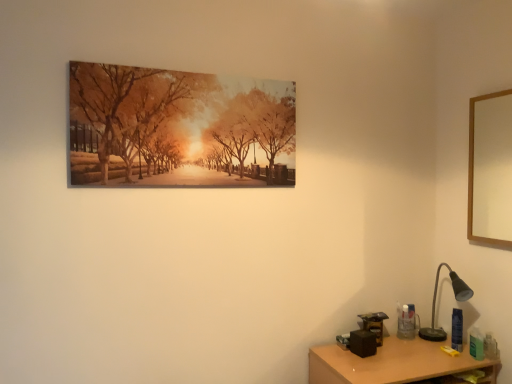
What do you see at coordinates (435, 304) in the screenshot? I see `black metal table lamp at lower right` at bounding box center [435, 304].

Describe the element at coordinates (490, 169) in the screenshot. This screenshot has width=512, height=384. I see `wooden picture frame at upper right, the second picture frame from the left` at that location.

What do you see at coordinates (393, 363) in the screenshot?
I see `wooden desk at lower right` at bounding box center [393, 363].

What do you see at coordinates (178, 129) in the screenshot? I see `matte canvas print at upper center, placed as the first picture frame when sorted from left to right` at bounding box center [178, 129].

Identify the location of black metal table lamp at lower right. (435, 304).

Does wooden picture frame at upper right, the second picture frame from the left, have a greater width compared to wooden desk at lower right?

No, wooden picture frame at upper right, the second picture frame from the left, is not wider than wooden desk at lower right.

Does wooden picture frame at upper right, the first picture frame viewed from the right, have a larger size compared to wooden desk at lower right?

A: No, wooden picture frame at upper right, the first picture frame viewed from the right, is not bigger than wooden desk at lower right.

From a real-world perspective, who is located lower, wooden picture frame at upper right, the second picture frame from the left, or wooden desk at lower right?

From a 3D spatial view, wooden desk at lower right is below.

Which of these two, matte canvas print at upper center, placed as the first picture frame when sorted from left to right, or black metal table lamp at lower right, is thinner?

With smaller width is matte canvas print at upper center, placed as the first picture frame when sorted from left to right.

Can you tell me how much matte canvas print at upper center, the second picture frame viewed from the right, and black metal table lamp at lower right differ in facing direction?

They differ by 11.4 degrees in their facing directions.

From a real-world perspective, which picture frame is the 2nd one above the black metal table lamp at lower right? Please provide its 2D coordinates.

[(178, 129)]

Considering the sizes of objects matte canvas print at upper center, the second picture frame viewed from the right, and black metal table lamp at lower right in the image provided, who is taller, matte canvas print at upper center, the second picture frame viewed from the right, or black metal table lamp at lower right?

With more height is matte canvas print at upper center, the second picture frame viewed from the right.

Can you confirm if matte canvas print at upper center, the second picture frame viewed from the right, is taller than wooden picture frame at upper right, the first picture frame viewed from the right?

No, matte canvas print at upper center, the second picture frame viewed from the right, is not taller than wooden picture frame at upper right, the first picture frame viewed from the right.

From the image's perspective, is matte canvas print at upper center, placed as the first picture frame when sorted from left to right, above or below wooden picture frame at upper right, the second picture frame from the left?

Based on their image positions, matte canvas print at upper center, placed as the first picture frame when sorted from left to right, is located above wooden picture frame at upper right, the second picture frame from the left.

Is matte canvas print at upper center, placed as the first picture frame when sorted from left to right, touching wooden picture frame at upper right, the second picture frame from the left?

There is a gap between matte canvas print at upper center, placed as the first picture frame when sorted from left to right, and wooden picture frame at upper right, the second picture frame from the left.

How many degrees apart are the facing directions of matte canvas print at upper center, the second picture frame viewed from the right, and wooden picture frame at upper right, the first picture frame viewed from the right?

matte canvas print at upper center, the second picture frame viewed from the right, and wooden picture frame at upper right, the first picture frame viewed from the right, are facing 90.5 degrees away from each other.

Which is more to the right, wooden desk at lower right or wooden picture frame at upper right, the second picture frame from the left?

From the viewer's perspective, wooden picture frame at upper right, the second picture frame from the left, appears more on the right side.

Is wooden desk at lower right wider than wooden picture frame at upper right, the second picture frame from the left?

Yes.

Considering the sizes of objects wooden desk at lower right and wooden picture frame at upper right, the second picture frame from the left, in the image provided, who is bigger, wooden desk at lower right or wooden picture frame at upper right, the second picture frame from the left,?

wooden desk at lower right is bigger.

From the picture: Is wooden desk at lower right next to wooden picture frame at upper right, the first picture frame viewed from the right?

wooden desk at lower right and wooden picture frame at upper right, the first picture frame viewed from the right, are clearly separated.

Is wooden desk at lower right smaller than matte canvas print at upper center, the second picture frame viewed from the right?

No, wooden desk at lower right is not smaller than matte canvas print at upper center, the second picture frame viewed from the right.

Is wooden desk at lower right not inside matte canvas print at upper center, the second picture frame viewed from the right?

wooden desk at lower right lies outside matte canvas print at upper center, the second picture frame viewed from the right,'s area.

Considering the points (343, 378) and (180, 139), which point is behind, point (343, 378) or point (180, 139)?

The point (180, 139) is more distant.

I want to click on table directly beneath the matte canvas print at upper center, the second picture frame viewed from the right (from a real-world perspective), so click(393, 363).

Considering the sizes of wooden picture frame at upper right, the first picture frame viewed from the right, and matte canvas print at upper center, placed as the first picture frame when sorted from left to right, in the image, is wooden picture frame at upper right, the first picture frame viewed from the right, wider or thinner than matte canvas print at upper center, placed as the first picture frame when sorted from left to right,?

In the image, wooden picture frame at upper right, the first picture frame viewed from the right, appears to be wider than matte canvas print at upper center, placed as the first picture frame when sorted from left to right.

Which object is positioned more to the left, wooden picture frame at upper right, the second picture frame from the left, or matte canvas print at upper center, the second picture frame viewed from the right?

matte canvas print at upper center, the second picture frame viewed from the right, is more to the left.

The height and width of the screenshot is (384, 512). Find the location of `picture frame lying above the wooden picture frame at upper right, the first picture frame viewed from the right (from the image's perspective)`. picture frame lying above the wooden picture frame at upper right, the first picture frame viewed from the right (from the image's perspective) is located at coordinates (178, 129).

Which of these two, wooden picture frame at upper right, the first picture frame viewed from the right, or black metal table lamp at lower right, stands shorter?

With less height is black metal table lamp at lower right.

Considering the sizes of objects wooden picture frame at upper right, the second picture frame from the left, and black metal table lamp at lower right in the image provided, who is bigger, wooden picture frame at upper right, the second picture frame from the left, or black metal table lamp at lower right?

With larger size is black metal table lamp at lower right.

Which is farther from the camera, (x=474, y=170) or (x=434, y=307)?

The point (x=434, y=307) is farther.

From a real-world perspective, count 1st picture frames upward from the wooden desk at lower right and point to it. Please provide its 2D coordinates.

[(490, 169)]

In the image, there is a matte canvas print at upper center, placed as the first picture frame when sorted from left to right. Identify the location of table lamp below it (from a real-world perspective). (435, 304).

Looking at the image, which one is located closer to black metal table lamp at lower right, wooden desk at lower right or matte canvas print at upper center, the second picture frame viewed from the right?

The object closer to black metal table lamp at lower right is wooden desk at lower right.

When comparing their distances from matte canvas print at upper center, placed as the first picture frame when sorted from left to right, does wooden picture frame at upper right, the second picture frame from the left, or wooden desk at lower right seem further?

wooden picture frame at upper right, the second picture frame from the left, is further to matte canvas print at upper center, placed as the first picture frame when sorted from left to right.

When comparing their distances from wooden desk at lower right, does matte canvas print at upper center, the second picture frame viewed from the right, or black metal table lamp at lower right seem further?

matte canvas print at upper center, the second picture frame viewed from the right, lies further to wooden desk at lower right than the other object.

When comparing their distances from matte canvas print at upper center, the second picture frame viewed from the right, does wooden desk at lower right or black metal table lamp at lower right seem closer?

wooden desk at lower right.

Looking at the image, which one is located closer to matte canvas print at upper center, the second picture frame viewed from the right, wooden picture frame at upper right, the first picture frame viewed from the right, or black metal table lamp at lower right?

black metal table lamp at lower right is positioned closer to the anchor matte canvas print at upper center, the second picture frame viewed from the right.

Which object lies nearer to the anchor point black metal table lamp at lower right, wooden picture frame at upper right, the first picture frame viewed from the right, or matte canvas print at upper center, the second picture frame viewed from the right?

wooden picture frame at upper right, the first picture frame viewed from the right, lies closer to black metal table lamp at lower right than the other object.

Looking at this image, which object lies further to the anchor point wooden desk at lower right, wooden picture frame at upper right, the second picture frame from the left, or black metal table lamp at lower right?

Based on the image, wooden picture frame at upper right, the second picture frame from the left, appears to be further to wooden desk at lower right.

When comparing their distances from wooden picture frame at upper right, the first picture frame viewed from the right, does black metal table lamp at lower right or matte canvas print at upper center, placed as the first picture frame when sorted from left to right, seem closer?

Based on the image, black metal table lamp at lower right appears to be nearer to wooden picture frame at upper right, the first picture frame viewed from the right.

Locate an element on the screen. The height and width of the screenshot is (384, 512). table lamp between wooden picture frame at upper right, the first picture frame viewed from the right, and wooden desk at lower right in the up-down direction is located at coordinates (435, 304).

Find the location of `table situated between matte canvas print at upper center, the second picture frame viewed from the right, and black metal table lamp at lower right from left to right`. table situated between matte canvas print at upper center, the second picture frame viewed from the right, and black metal table lamp at lower right from left to right is located at coordinates (393, 363).

Find the location of a particular element. table lamp between matte canvas print at upper center, the second picture frame viewed from the right, and wooden picture frame at upper right, the second picture frame from the left, from left to right is located at coordinates (435, 304).

This screenshot has height=384, width=512. What are the coordinates of `table between matte canvas print at upper center, the second picture frame viewed from the right, and wooden picture frame at upper right, the first picture frame viewed from the right, from left to right` in the screenshot? It's located at (393, 363).